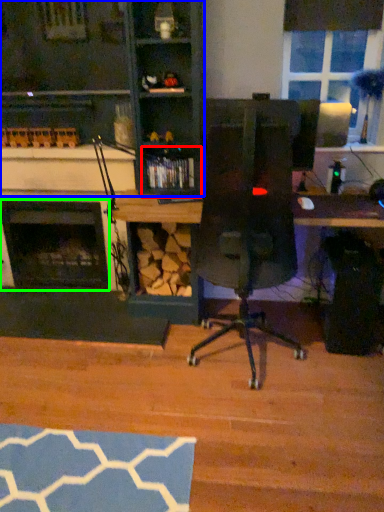
Question: Based on their relative distances, which object is nearer to shelf (highlighted by a red box)? Choose from cabinetry (highlighted by a blue box) and fireplace (highlighted by a green box).

Choices:
 (A) cabinetry
 (B) fireplace

Answer: (A)